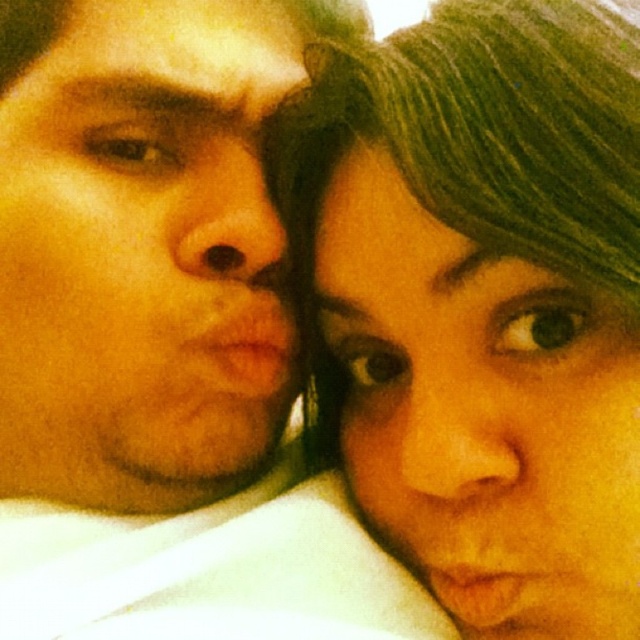
You are a photographer adjusting the focus of your camera. You want to ensure that both the matte skin face at left and the green matte hair at upper right are in focus. Given that the depth of field can only accommodate one of them clearly, which object should you prioritize focusing on to capture the most detailed subject?

The matte skin face at left is smaller than the green matte hair at upper right, so you should prioritize focusing on the matte skin face at left to ensure its details are captured clearly since it requires a narrower focus area compared to the larger green matte hair at upper right.

You are a photographer trying to capture a closeup shot of both the matte skin face at left and the green matte hair at upper right. Based on their positions, which object might require more space in the frame to avoid being cut off?

The matte skin face at left might require more space in the frame to avoid being cut off since it might be wider than the green matte hair at upper right.

You are a photographer using a camera with a 5 inch wide lens. You want to capture a photo of the matte skin face at left and the green matte hair at upper right in the same frame. Can the lens fit both objects in the frame?

The matte skin face at left and green matte hair at upper right are 4.43 inches apart from each other. Since the lens is 5 inches wide, it can accommodate the 4.43 inch distance between them, so yes, both objects can fit in the frame.